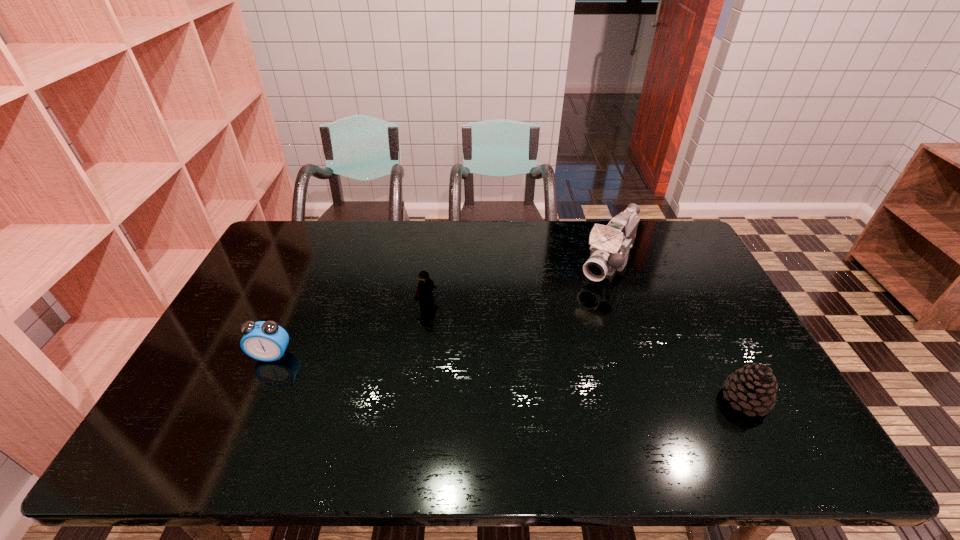
Find the location of a particular element. The image size is (960, 540). vacant area between the third object from right to left and the rightmost object is located at coordinates (586, 352).

Image resolution: width=960 pixels, height=540 pixels. I want to click on free space between the second object from left to right and the second nearest object, so click(x=349, y=329).

Identify the location of vacant point located between the third farthest object and the pinecone. This screenshot has width=960, height=540. 508,377.

The width and height of the screenshot is (960, 540). Identify the location of vacant space that is in between the third object from left to right and the leftmost object. (440, 308).

Find the location of a particular element. free spot between the alarm clock and the third object from right to left is located at coordinates (349, 329).

This screenshot has width=960, height=540. What are the coordinates of `vacant space in between the third object from left to right and the third object from right to left` in the screenshot? It's located at (517, 282).

Identify which object is the second closest to the second farthest object. Please provide its 2D coordinates. Your answer should be formatted as a tuple, i.e. [(x, y)], where the tuple contains the x and y coordinates of a point satisfying the conditions above.

[(610, 245)]

At what (x,y) coordinates should I click in order to perform the action: click on object that ranks as the closest to the second object from left to right. Please return your answer as a coordinate pair (x, y). Looking at the image, I should click on (266, 341).

Find the location of a particular element. free space that satisfies the following two spatial constraints: 1. on the face of the rightmost object; 2. at the narrow end of the second nearest object is located at coordinates (252, 400).

I want to click on free space that satisfies the following two spatial constraints: 1. on the face of the nearest object; 2. at the narrow end of the leftmost object, so click(252, 400).